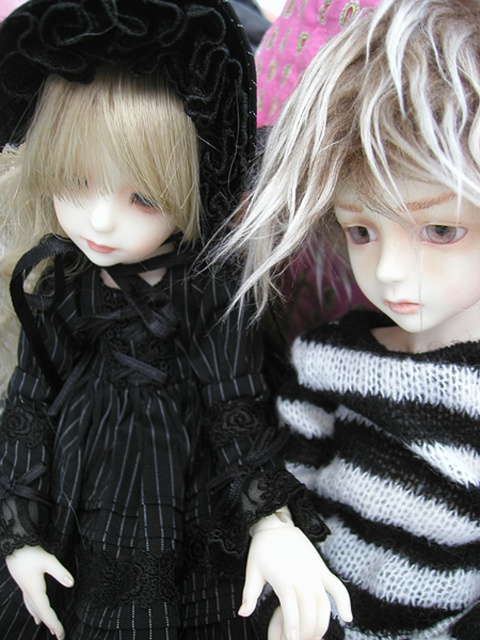
You are an artist trying to sketch the image. You need to place the matte black dress at left precisely on your canvas. What are the coordinates where you should position it?

The coordinates for the matte black dress at left are at point (135, 337).

You are a fashion designer looking at two dresses in the image. The matte black dress at left and the black pinstriped dress at center. Which one is positioned to the left?

The matte black dress at left is positioned to the left of the black pinstriped dress at center.